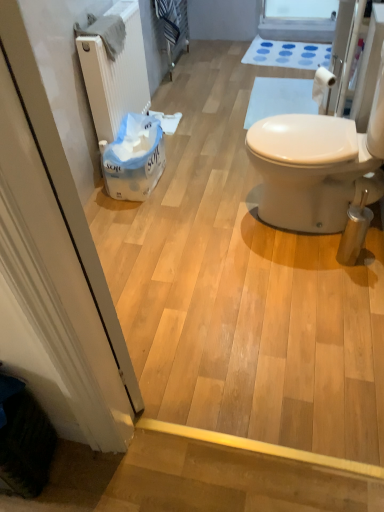
Question: From the image's perspective, is white rubber bath mat at upper center positioned above or below white soft tissue at center, placed as the first toilet paper when sorted from back to front?

Choices:
 (A) below
 (B) above

Answer: (B)

Question: Considering the positions of white rubber bath mat at upper center and white soft tissue at center, placed as the first toilet paper when sorted from back to front, in the image, is white rubber bath mat at upper center taller or shorter than white soft tissue at center, placed as the first toilet paper when sorted from back to front,?

Choices:
 (A) tall
 (B) short

Answer: (B)

Question: Which of these objects is positioned closest to the white matte toilet paper at upper right, marked as the 2th toilet paper in a back-to-front arrangement?

Choices:
 (A) white matte screen door at left
 (B) white soft tissue at center, arranged as the first toilet paper when viewed from the left
 (C) transparent plastic window screen at upper center
 (D) beige textured radiator at left
 (E) white rubber bath mat at upper center

Answer: (B)

Question: Considering the real-world distances, which object is closest to the white soft tissue at center, which is the second toilet paper in front-to-back order?

Choices:
 (A) white matte screen door at left
 (B) white rubber bath mat at upper center
 (C) transparent plastic window screen at upper center
 (D) white matte toilet paper at upper right, the first toilet paper when ordered from right to left
 (E) beige textured radiator at left

Answer: (E)